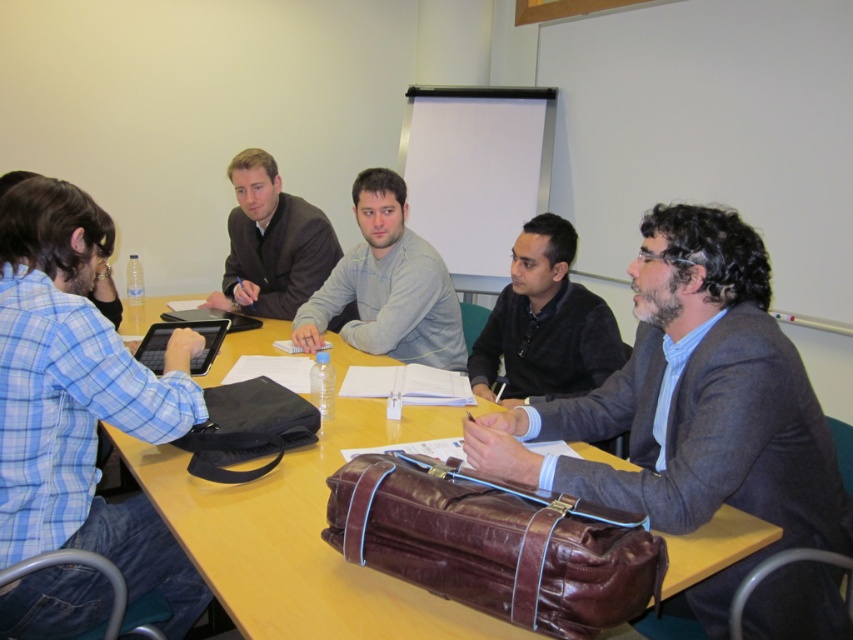
Is point (506, 360) positioned in front of point (242, 232)?

Yes, it is in front of point (242, 232).

Based on the photo, can you confirm if black matte jacket at center is taller than matte black suit at upper center?

In fact, black matte jacket at center may be shorter than matte black suit at upper center.

Between point (579, 298) and point (241, 180), which one is positioned in front?

Point (579, 298) is in front.

Locate an element on the screen. black matte jacket at center is located at coordinates (544, 323).

Does yellow wood table at center have a smaller size compared to black matte jacket at center?

No, yellow wood table at center is not smaller than black matte jacket at center.

Can you confirm if yellow wood table at center is positioned below black matte jacket at center?

Correct, yellow wood table at center is located below black matte jacket at center.

Which is in front, point (337, 566) or point (554, 276)?

Point (337, 566)

You are a GUI agent. You are given a task and a screenshot of the screen. Output one action in this format:
    pyautogui.click(x=<x>, y=<y>)
    Task: Click on the yellow wood table at center
    
    Given the screenshot: What is the action you would take?
    pyautogui.click(x=302, y=538)

Which is behind, point (654, 580) or point (393, 339)?

Positioned behind is point (393, 339).

Between leather briefcase at lower right and gray fleece sweater at center, which one has less height?

Standing shorter between the two is leather briefcase at lower right.

Which is in front, point (469, 518) or point (379, 346)?

Point (469, 518) is more forward.

Locate an element on the screen. leather briefcase at lower right is located at coordinates (494, 544).